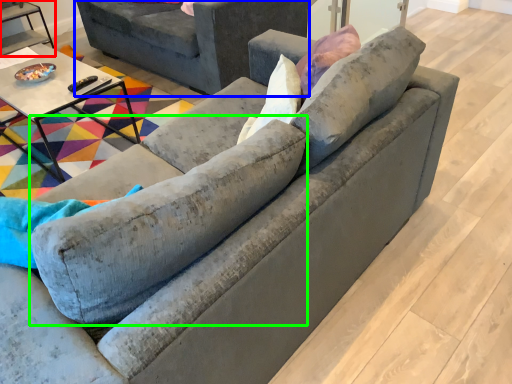
Question: Which object is the closest to the table (highlighted by a red box)? Choose among these: studio couch (highlighted by a blue box) or swivel chair (highlighted by a green box).

Choices:
 (A) studio couch
 (B) swivel chair

Answer: (A)